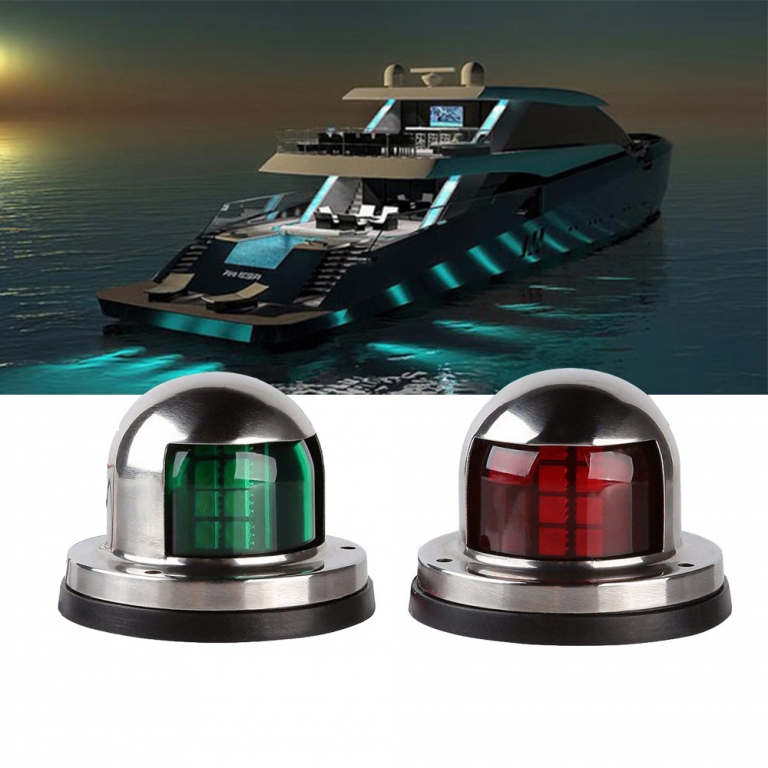
Locate an element on the screen. This screenshot has height=768, width=768. screen is located at coordinates click(x=442, y=114).